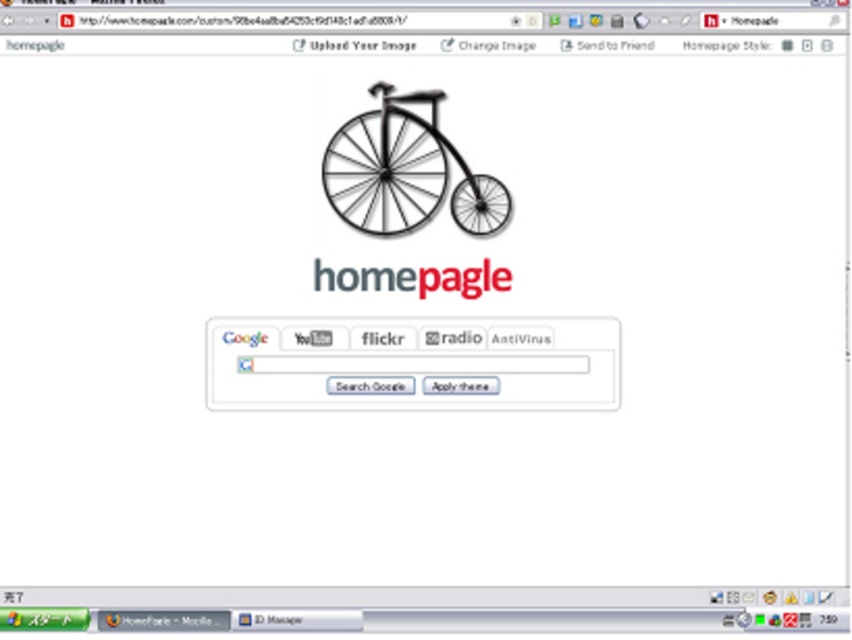
Question: Is black matte bicycle at center to the left of red matte homepage at center from the viewer's perspective?

Choices:
 (A) yes
 (B) no

Answer: (B)

Question: Based on their relative distances, which object is farther from the red matte homepage at center?

Choices:
 (A) black matte bicycle at center
 (B) black matte wheel at center

Answer: (A)

Question: Does black matte bicycle at center come behind red matte homepage at center?

Choices:
 (A) yes
 (B) no

Answer: (B)

Question: Estimate the real-world distances between objects in this image. Which object is farther from the black matte bicycle at center?

Choices:
 (A) black matte wheel at center
 (B) red matte homepage at center

Answer: (B)

Question: Which object appears farthest from the camera in this image?

Choices:
 (A) red matte homepage at center
 (B) black matte wheel at center

Answer: (B)

Question: Is red matte homepage at center above black matte wheel at center?

Choices:
 (A) no
 (B) yes

Answer: (A)